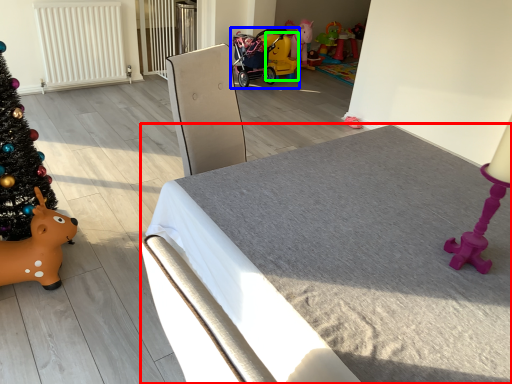
Question: Which object is the closest to the furniture (highlighted by a red box)? Choose among these: toy (highlighted by a blue box) or toy (highlighted by a green box).

Choices:
 (A) toy
 (B) toy

Answer: (A)